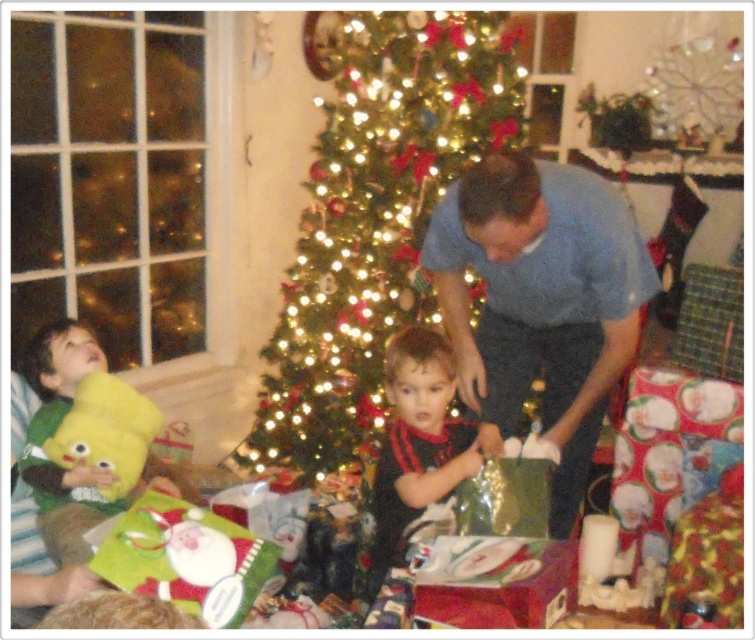
Question: Is green shiny tree at center further to camera compared to blue cotton shirt at center?

Choices:
 (A) no
 (B) yes

Answer: (B)

Question: Does green shiny tree at center appear on the left side of black matte shirt at center?

Choices:
 (A) no
 (B) yes

Answer: (B)

Question: Which object is the farthest from the black matte shirt at center?

Choices:
 (A) blue cotton shirt at center
 (B) yellow plush toy at left

Answer: (B)

Question: Does green shiny tree at center appear over blue cotton shirt at center?

Choices:
 (A) yes
 (B) no

Answer: (A)

Question: Which point is farther to the camera?

Choices:
 (A) (541, 280)
 (B) (103, 404)

Answer: (B)

Question: Which is farther from the blue cotton shirt at center?

Choices:
 (A) yellow plush toy at left
 (B) green shiny tree at center

Answer: (A)